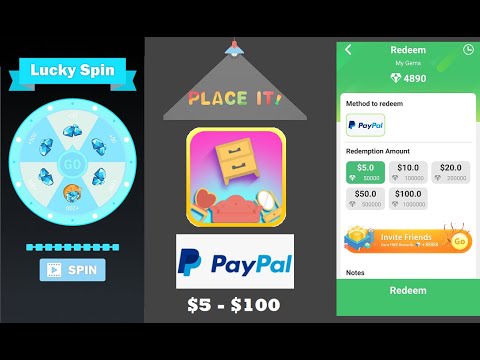
Find the location of a particular element. mirror is located at coordinates (264, 198).